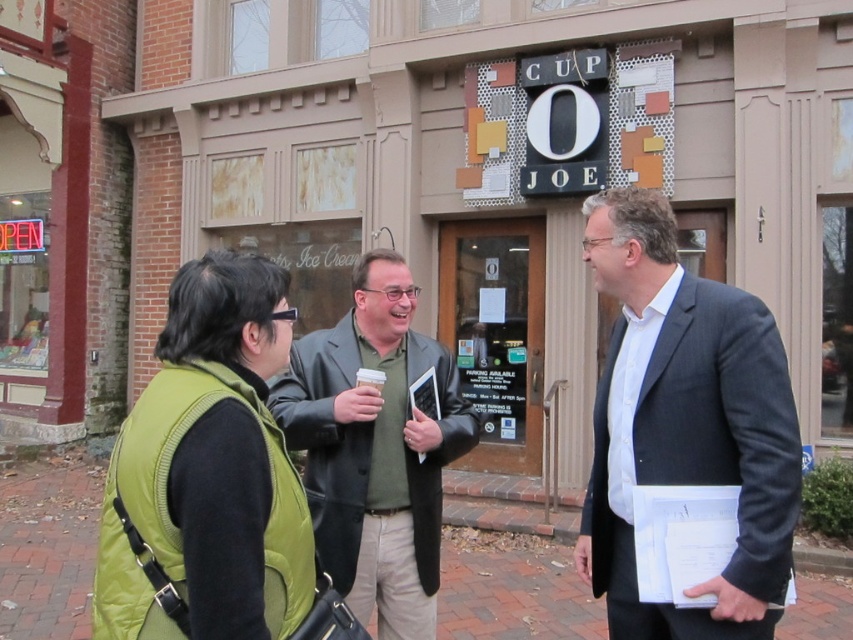
Question: Based on their relative distances, which object is farther from the dark gray suit at center?

Choices:
 (A) brick pavement at lower center
 (B) green quilted vest at lower left
 (C) green fabric jacket at center

Answer: (A)

Question: Which point is farther from the camera taking this photo?

Choices:
 (A) (54, 602)
 (B) (316, 451)
 (C) (796, 518)
 (D) (154, 536)

Answer: (A)

Question: Can you confirm if green fabric jacket at center is wider than brick pavement at lower center?

Choices:
 (A) no
 (B) yes

Answer: (A)

Question: Can you confirm if green quilted vest at lower left is positioned below green fabric jacket at center?

Choices:
 (A) yes
 (B) no

Answer: (B)

Question: From the image, what is the correct spatial relationship of green quilted vest at lower left in relation to brick pavement at lower center?

Choices:
 (A) above
 (B) below

Answer: (A)

Question: Among these objects, which one is nearest to the camera?

Choices:
 (A) green quilted vest at lower left
 (B) green fabric jacket at center
 (C) brick pavement at lower center

Answer: (A)